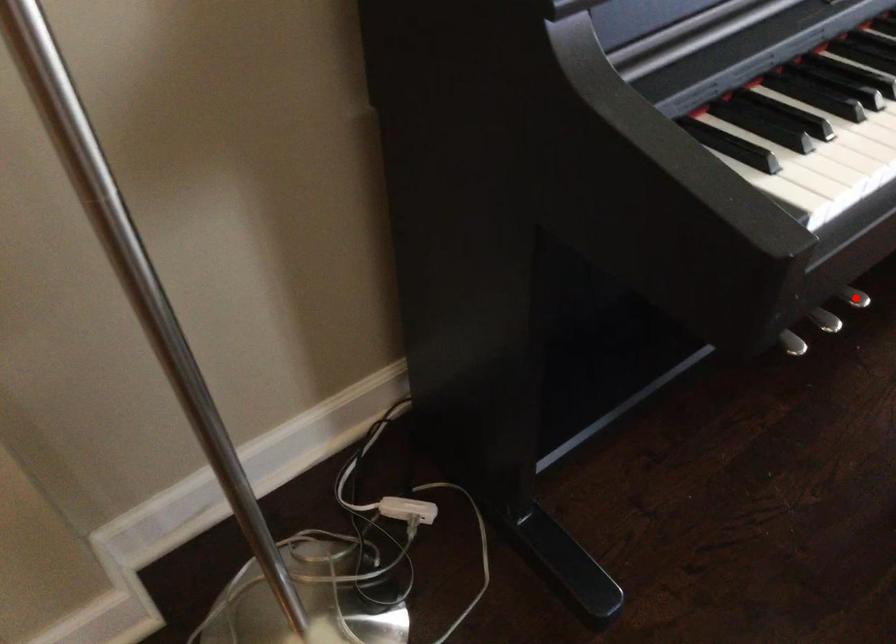
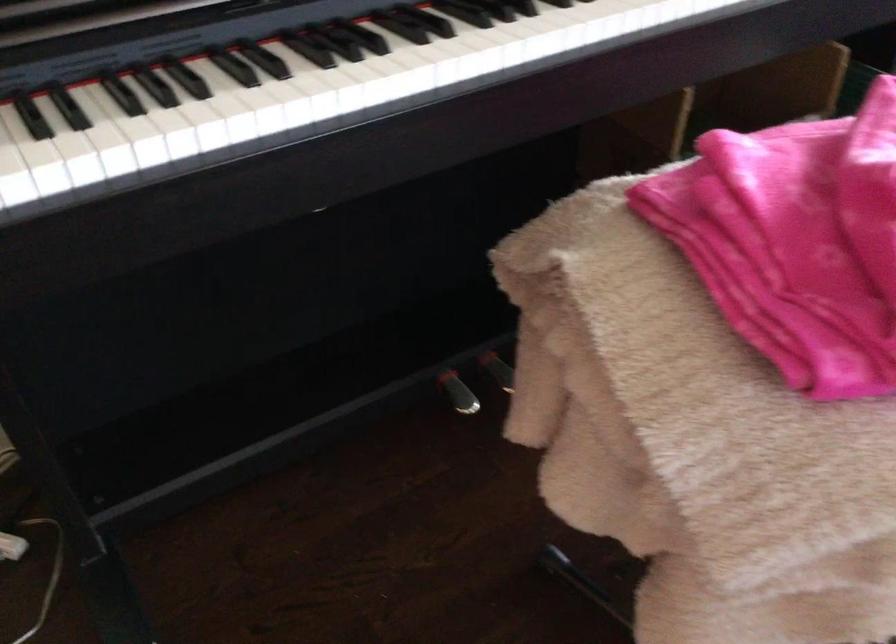
Question: I am providing you with two images of the same scene from different viewpoints. A red point is marked on the first image. At the location where the point appears in image 1, is it still visible in image 2?

Choices:
 (A) Yes
 (B) No

Answer: (B)